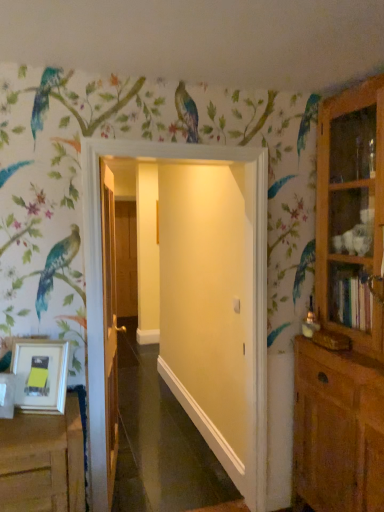
The height and width of the screenshot is (512, 384). In order to click on unoccupied region to the right of wooden door at center, marked as the 2th door in a front-to-back arrangement in this screenshot , I will do coord(167,477).